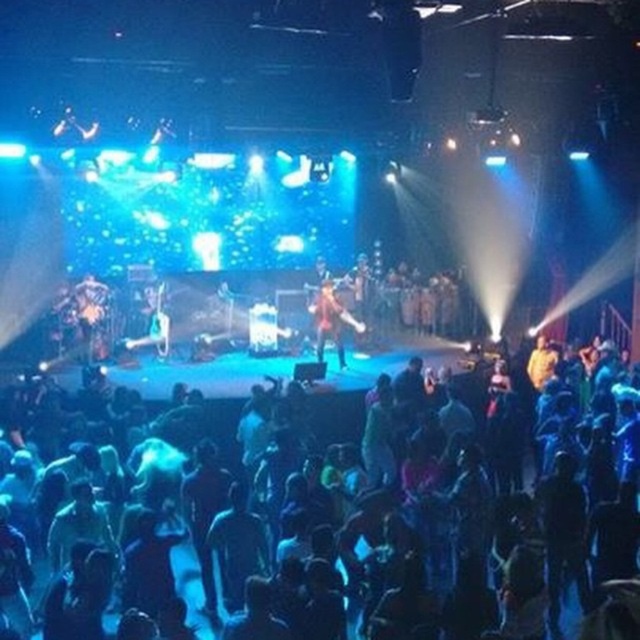
Question: Which of the following is the farthest from the observer?

Choices:
 (A) (356, 584)
 (B) (326, 333)

Answer: (B)

Question: Which of the following is the farthest from the observer?

Choices:
 (A) shiny red jacket at center
 (B) black matte crowd at lower left

Answer: (A)

Question: Can you confirm if black matte crowd at lower left is thinner than shiny red jacket at center?

Choices:
 (A) no
 (B) yes

Answer: (B)

Question: Does black matte crowd at lower left have a lesser width compared to shiny red jacket at center?

Choices:
 (A) yes
 (B) no

Answer: (A)

Question: Can you confirm if black matte crowd at lower left is bigger than shiny red jacket at center?

Choices:
 (A) no
 (B) yes

Answer: (A)